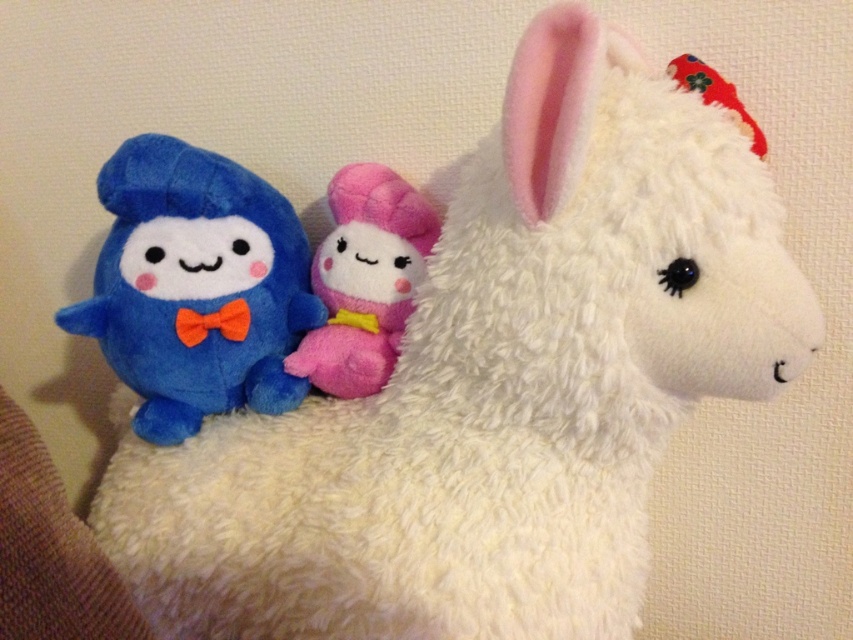
You are a child trying to reach for the blue plush toy at left and the pink plush toy at center. Which one can you grab first without moving your hand?

The blue plush toy at left is closer to you than the pink plush toy at center, so you can grab it first without moving your hand.

You are standing 2 meters away from the point at point (219, 250). If you walk straight towards it, how far will you have to walk to reach the point?

The point at point (219, 250) is 1.08 meters away from the other objects, so you would need to walk 1.08 meters to reach it.